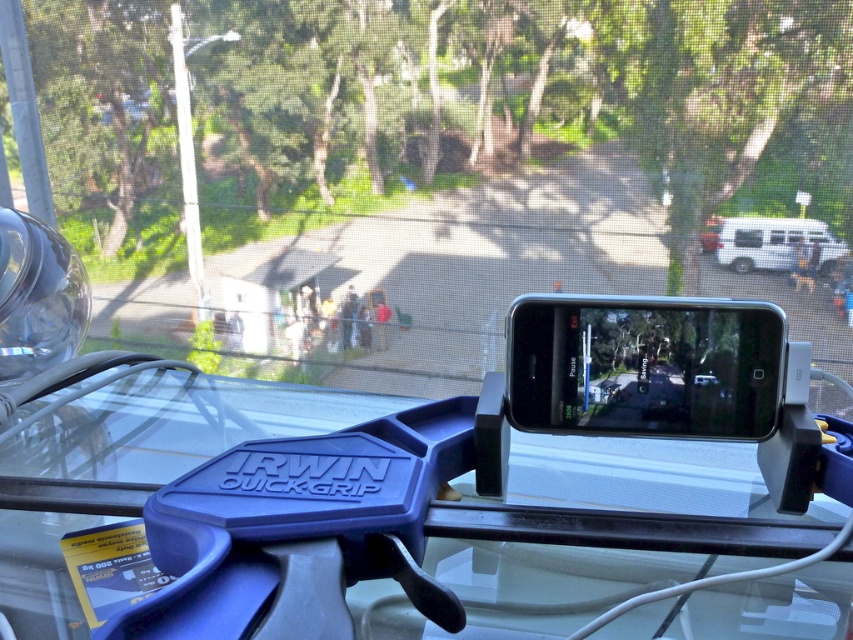
Question: Is black glossy phone at center wider than white matte van at right?

Choices:
 (A) no
 (B) yes

Answer: (B)

Question: Is the position of blue plastic clamp at center less distant than that of white matte van at right?

Choices:
 (A) no
 (B) yes

Answer: (B)

Question: Which of the following is the closest to the observer?

Choices:
 (A) (302, 488)
 (B) (659, 332)
 (C) (799, 236)

Answer: (A)

Question: Which of the following is the farthest from the observer?

Choices:
 (A) (457, 474)
 (B) (811, 244)

Answer: (B)

Question: Does blue plastic clamp at center appear over black glossy phone at center?

Choices:
 (A) no
 (B) yes

Answer: (A)

Question: Which object is the closest to the white matte van at right?

Choices:
 (A) blue plastic clamp at center
 (B) black glossy phone at center

Answer: (B)